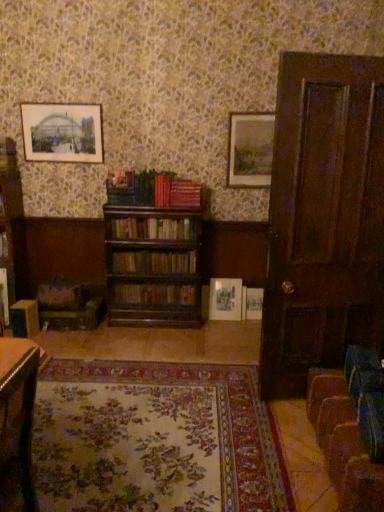
Image resolution: width=384 pixels, height=512 pixels. I want to click on empty space that is ontop of black paper picture frame at upper left, which is the 4th picture frame in bottom-to-top order (from a real-world perspective), so click(70, 100).